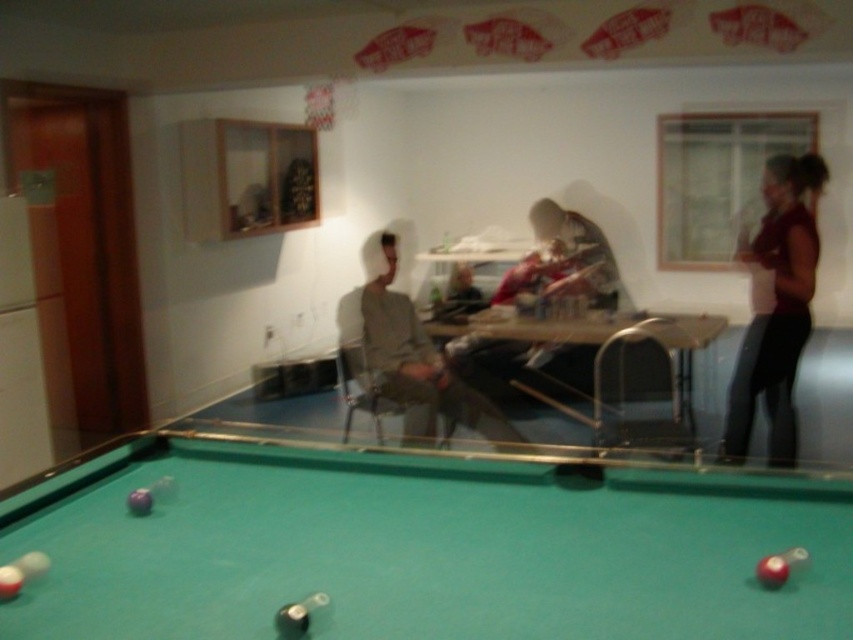
Consider the image. Is green felt billiard table at lower center below dark red fabric at right?

Correct, green felt billiard table at lower center is located below dark red fabric at right.

Which is behind, point (717, 509) or point (753, 317)?

The point (753, 317) is behind.

The image size is (853, 640). Identify the location of green felt billiard table at lower center. (421, 547).

In order to click on green felt billiard table at lower center in this screenshot , I will do `click(421, 547)`.